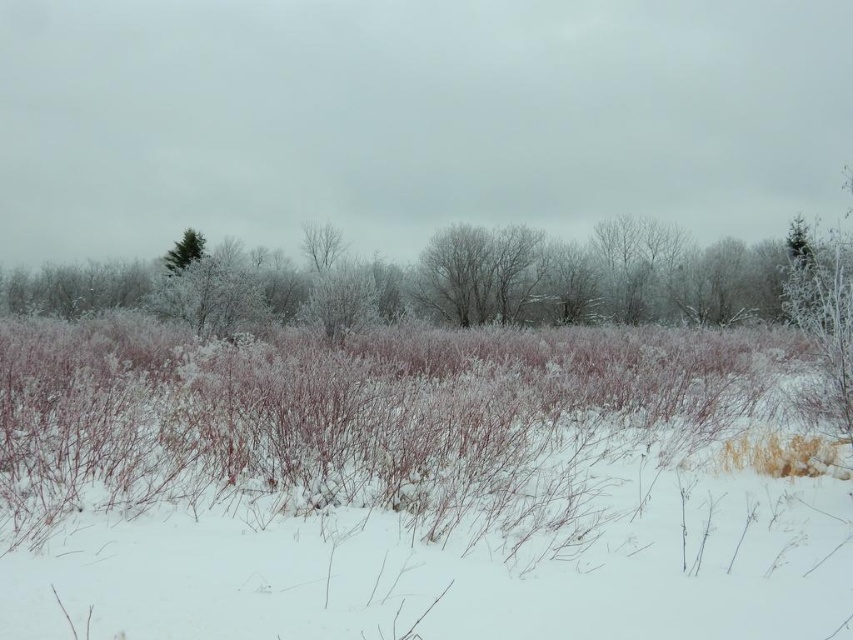
Question: Which point is farther to the camera?

Choices:
 (A) frosty bark tree at center
 (B) frosty branches at center

Answer: (A)

Question: Which point is farther from the camera taking this photo?

Choices:
 (A) (311, 230)
 (B) (465, 284)

Answer: (A)

Question: Is frosty branches at center to the left of green matte tree at upper left from the viewer's perspective?

Choices:
 (A) no
 (B) yes

Answer: (A)

Question: In this image, where is frosty branches at center located relative to frosty bark tree at center?

Choices:
 (A) below
 (B) above

Answer: (A)

Question: Estimate the real-world distances between objects in this image. Which object is closer to the green matte tree at upper left?

Choices:
 (A) frosty branches at center
 (B) frosty bark tree at center

Answer: (B)

Question: Can you confirm if frosty branches at center is bigger than green matte tree at upper left?

Choices:
 (A) no
 (B) yes

Answer: (B)